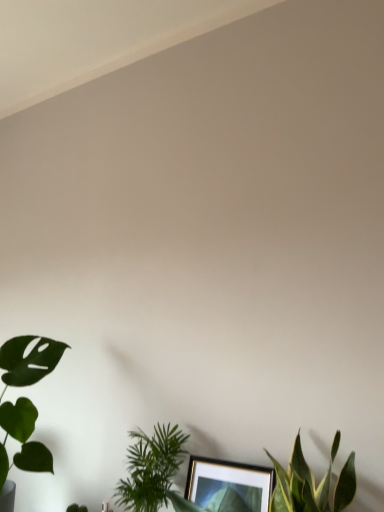
Question: Does green matte leaf at lower left, which is the 3th houseplant in right-to-left order, appear on the left side of green leafy plant at lower left?

Choices:
 (A) yes
 (B) no

Answer: (A)

Question: Is green matte leaf at lower left, placed as the first houseplant when sorted from left to right, not near green leafy plant at lower left?

Choices:
 (A) yes
 (B) no

Answer: (B)

Question: From the image's perspective, is green matte leaf at lower left, which is the 3th houseplant in right-to-left order, located above green leafy plant at lower left?

Choices:
 (A) yes
 (B) no

Answer: (A)

Question: Considering the relative sizes of green matte leaf at lower left, which is the 3th houseplant in right-to-left order, and green leafy plant at lower left in the image provided, is green matte leaf at lower left, which is the 3th houseplant in right-to-left order, bigger than green leafy plant at lower left?

Choices:
 (A) yes
 (B) no

Answer: (A)

Question: Can you confirm if green matte leaf at lower left, which is the 3th houseplant in right-to-left order, is taller than green leafy plant at lower left?

Choices:
 (A) yes
 (B) no

Answer: (A)

Question: From the image's perspective, is green matte leaf at lower left, placed as the first houseplant when sorted from left to right, below green leafy plant at lower left?

Choices:
 (A) yes
 (B) no

Answer: (B)

Question: Is green leafy plant at lower left not close to green leafy plant at lower center, which is the 3th houseplant in left-to-right order?

Choices:
 (A) yes
 (B) no

Answer: (B)

Question: Is green leafy plant at lower left shorter than green leafy plant at lower center, positioned as the first houseplant in right-to-left order?

Choices:
 (A) yes
 (B) no

Answer: (A)

Question: Does green leafy plant at lower left come in front of green leafy plant at lower center, which is the 3th houseplant in left-to-right order?

Choices:
 (A) no
 (B) yes

Answer: (A)

Question: From the image's perspective, is green leafy plant at lower left located above green leafy plant at lower center, positioned as the first houseplant in right-to-left order?

Choices:
 (A) yes
 (B) no

Answer: (B)

Question: Considering the relative sizes of green leafy plant at lower left and green leafy plant at lower center, positioned as the first houseplant in right-to-left order, in the image provided, is green leafy plant at lower left thinner than green leafy plant at lower center, positioned as the first houseplant in right-to-left order,?

Choices:
 (A) no
 (B) yes

Answer: (B)

Question: From the image's perspective, would you say green leafy plant at lower left is shown under green leafy plant at lower center, which is the 3th houseplant in left-to-right order?

Choices:
 (A) no
 (B) yes

Answer: (B)

Question: Can you confirm if green matte leaf at lower left, placed as the first houseplant when sorted from left to right, is smaller than green leafy plant at lower center, arranged as the second houseplant when viewed from the right?

Choices:
 (A) no
 (B) yes

Answer: (A)